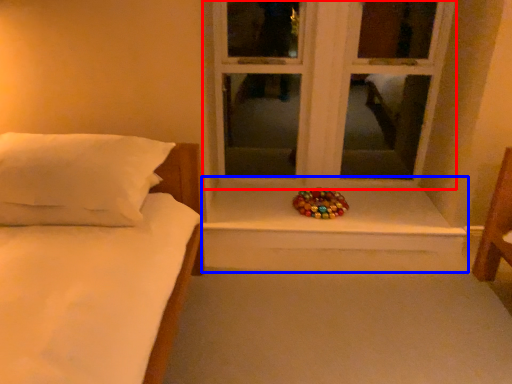
Question: Among these objects, which one is farthest to the camera, window (highlighted by a red box) or window sill (highlighted by a blue box)?

Choices:
 (A) window
 (B) window sill

Answer: (B)